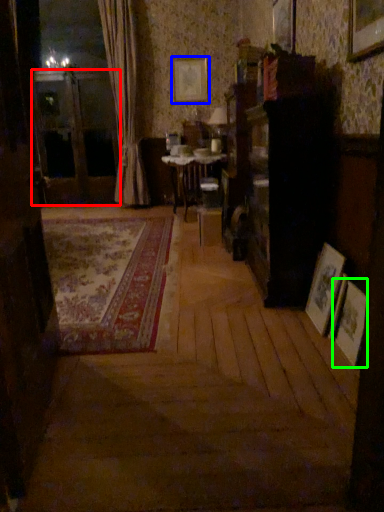
Question: Considering the real-world distances, which object is farthest from screen door (highlighted by a red box)? picture frame (highlighted by a blue box) or picture frame (highlighted by a green box)?

Choices:
 (A) picture frame
 (B) picture frame

Answer: (B)